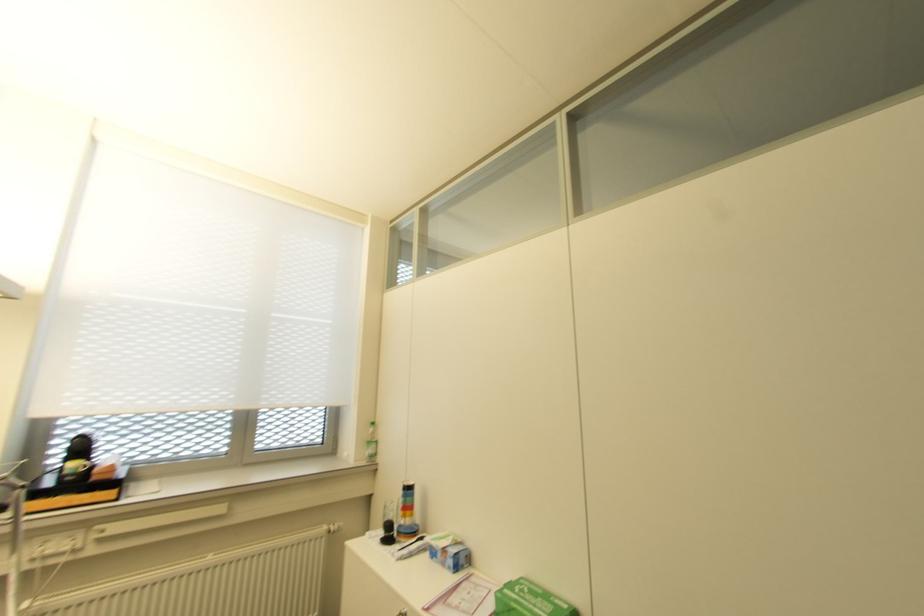
Identify the location of green plastic bottle. The height and width of the screenshot is (616, 924). (371, 443).